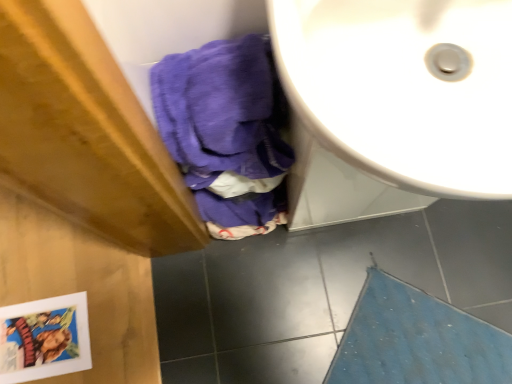
Identify the location of white glossy sink at upper right. This screenshot has width=512, height=384. pyautogui.click(x=403, y=88).

The image size is (512, 384). Describe the element at coordinates (403, 88) in the screenshot. I see `white glossy sink at upper right` at that location.

Describe the element at coordinates (416, 340) in the screenshot. I see `blue textured bath mat at lower right` at that location.

Locate an element on the screen. blue textured bath mat at lower right is located at coordinates (416, 340).

What are the coordinates of `white glossy sink at upper right` in the screenshot? It's located at (403, 88).

In the image, is blue textured bath mat at lower right on the left side or the right side of white glossy sink at upper right?

Based on their positions, blue textured bath mat at lower right is located to the right of white glossy sink at upper right.

Is blue textured bath mat at lower right positioned before white glossy sink at upper right?

No.

Between point (364, 305) and point (495, 157), which one is positioned behind?

Point (364, 305)

From the image's perspective, who appears lower, blue textured bath mat at lower right or white glossy sink at upper right?

blue textured bath mat at lower right.

From a real-world perspective, is blue textured bath mat at lower right physically located above or below white glossy sink at upper right?

blue textured bath mat at lower right is below white glossy sink at upper right.

Which object is thinner, blue textured bath mat at lower right or white glossy sink at upper right?

Thinner between the two is white glossy sink at upper right.

Considering the sizes of blue textured bath mat at lower right and white glossy sink at upper right in the image, is blue textured bath mat at lower right taller or shorter than white glossy sink at upper right?

Considering their sizes, blue textured bath mat at lower right has less height than white glossy sink at upper right.

Is blue textured bath mat at lower right bigger or smaller than white glossy sink at upper right?

In the image, blue textured bath mat at lower right appears to be smaller than white glossy sink at upper right.

Is blue textured bath mat at lower right outside of white glossy sink at upper right?

Absolutely, blue textured bath mat at lower right is external to white glossy sink at upper right.

Can you see blue textured bath mat at lower right touching white glossy sink at upper right?

blue textured bath mat at lower right and white glossy sink at upper right are not in contact.

Consider the image. Is blue textured bath mat at lower right oriented away from white glossy sink at upper right?

No, blue textured bath mat at lower right's orientation is not away from white glossy sink at upper right.

How distant is blue textured bath mat at lower right from white glossy sink at upper right?

blue textured bath mat at lower right and white glossy sink at upper right are 31.63 inches apart from each other.

At what (x,y) coordinates should I click in order to perform the action: click on bath mat located underneath the white glossy sink at upper right (from a real-world perspective). Please return your answer as a coordinate pair (x, y). Image resolution: width=512 pixels, height=384 pixels. Looking at the image, I should click on (416, 340).

In the image, is white glossy sink at upper right on the left side or the right side of blue textured bath mat at lower right?

From the image, it's evident that white glossy sink at upper right is to the left of blue textured bath mat at lower right.

Between white glossy sink at upper right and blue textured bath mat at lower right, which one is positioned in front?

white glossy sink at upper right.

Which is in front, point (294, 77) or point (420, 298)?

The point (294, 77) is closer.

From the image's perspective, is white glossy sink at upper right located above or below blue textured bath mat at lower right?

Based on their image positions, white glossy sink at upper right is located above blue textured bath mat at lower right.

From a real-world perspective, is white glossy sink at upper right above or below blue textured bath mat at lower right?

In terms of real-world spatial position, white glossy sink at upper right is above blue textured bath mat at lower right.

Which of these two, white glossy sink at upper right or blue textured bath mat at lower right, is thinner?

white glossy sink at upper right.

Can you confirm if white glossy sink at upper right is taller than blue textured bath mat at lower right?

Indeed, white glossy sink at upper right has a greater height compared to blue textured bath mat at lower right.

Considering the relative sizes of white glossy sink at upper right and blue textured bath mat at lower right in the image provided, is white glossy sink at upper right smaller than blue textured bath mat at lower right?

Actually, white glossy sink at upper right might be larger than blue textured bath mat at lower right.

Is white glossy sink at upper right completely or partially outside of blue textured bath mat at lower right?

That's correct, white glossy sink at upper right is outside of blue textured bath mat at lower right.

Is white glossy sink at upper right in contact with blue textured bath mat at lower right?

No, white glossy sink at upper right is not next to blue textured bath mat at lower right.

Is white glossy sink at upper right oriented towards blue textured bath mat at lower right?

Yes, white glossy sink at upper right is facing blue textured bath mat at lower right.

At what (x,y) coordinates should I click in order to perform the action: click on sink above the blue textured bath mat at lower right (from the image's perspective). Please return your answer as a coordinate pair (x, y). This screenshot has width=512, height=384. Looking at the image, I should click on (403, 88).

Where is `bath mat located below the white glossy sink at upper right (from the image's perspective)`? This screenshot has width=512, height=384. bath mat located below the white glossy sink at upper right (from the image's perspective) is located at coordinates (416, 340).

This screenshot has width=512, height=384. I want to click on sink located above the blue textured bath mat at lower right (from the image's perspective), so click(x=403, y=88).